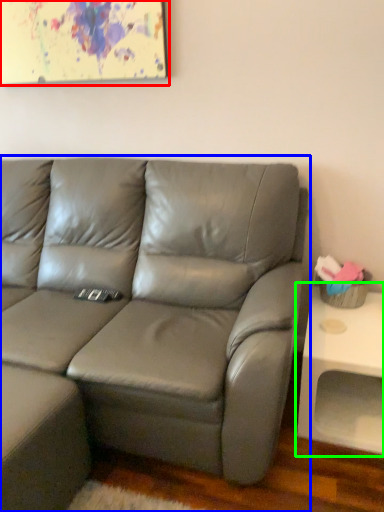
Question: Considering the real-world distances, which object is farthest from picture frame (highlighted by a red box)? studio couch (highlighted by a blue box) or table (highlighted by a green box)?

Choices:
 (A) studio couch
 (B) table

Answer: (B)